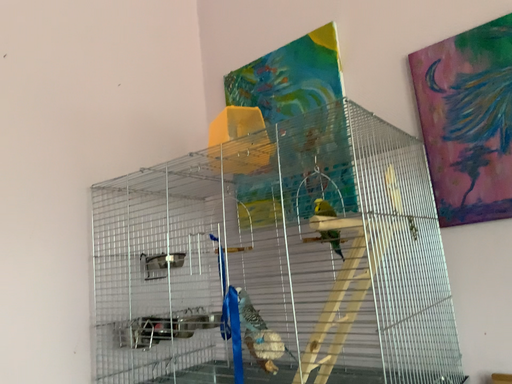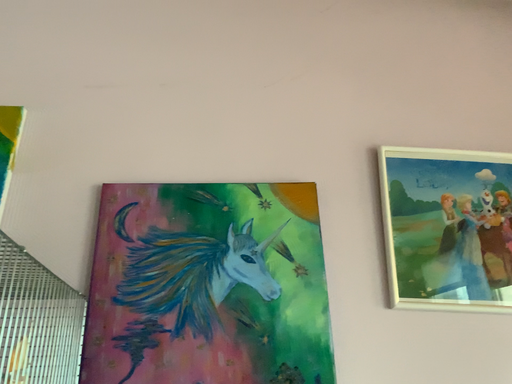
Question: Which way did the camera rotate in the video?

Choices:
 (A) rotated upward
 (B) rotated downward

Answer: (A)